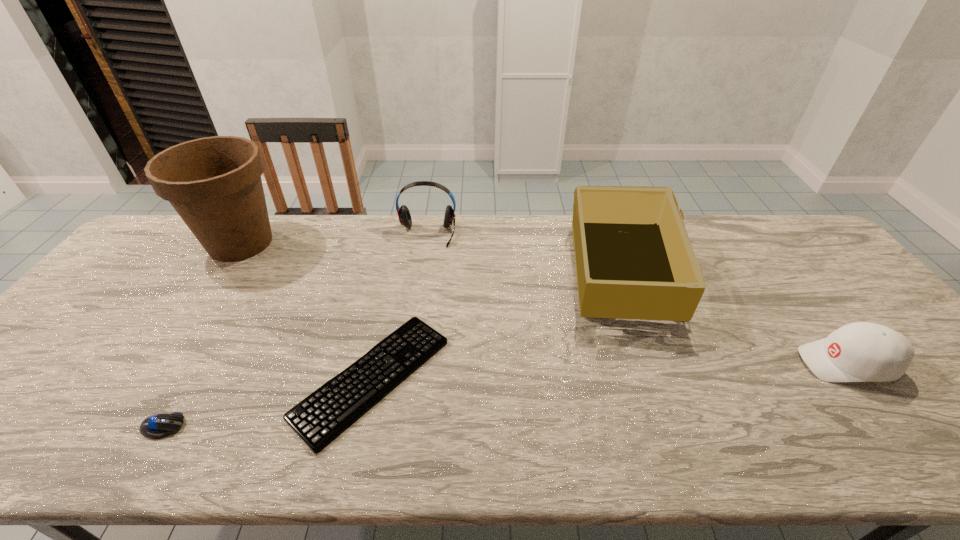
Locate an element on the screen. vacant space located 0.120m on the front-facing side of the third shortest object is located at coordinates (752, 363).

Identify the location of free location located on the front-facing side of the third shortest object. (661, 363).

Locate an element on the screen. This screenshot has width=960, height=540. vacant space located 0.100m on the front-facing side of the third shortest object is located at coordinates (760, 363).

Locate an element on the screen. The width and height of the screenshot is (960, 540). free space located on the button side of the computer mouse is located at coordinates (282, 427).

Identify the location of vacant space located 0.260m on the back of the computer keyboard. This screenshot has width=960, height=540. (398, 257).

Image resolution: width=960 pixels, height=540 pixels. What are the coordinates of `flowerpot that is at the far edge` in the screenshot? It's located at (x=214, y=183).

This screenshot has width=960, height=540. Find the location of `box that is at the far edge`. box that is at the far edge is located at coordinates coord(633,257).

Identify the location of headset positioned at the far edge. The image size is (960, 540). (403, 212).

The height and width of the screenshot is (540, 960). I want to click on computer mouse present at the near edge, so click(x=160, y=425).

Locate an element on the screen. The image size is (960, 540). computer keyboard located at the near edge is located at coordinates (321, 417).